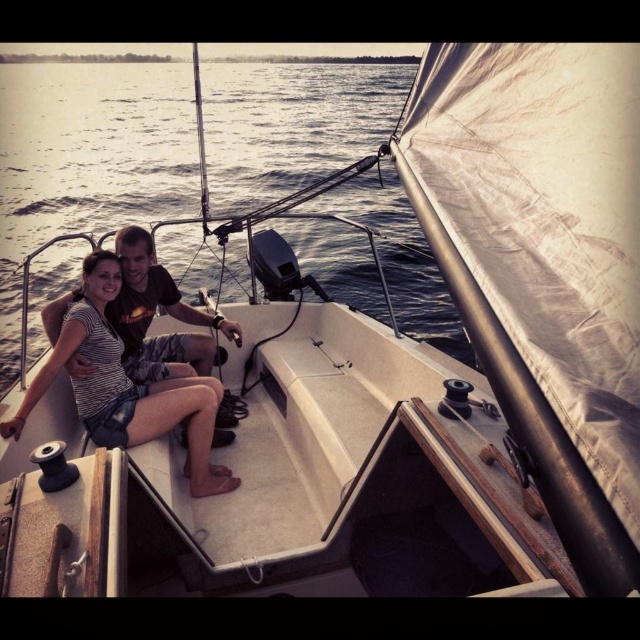
Between striped fabric dress at center and matte black shirt at center, which one appears on the left side from the viewer's perspective?

matte black shirt at center

Who is higher up, striped fabric dress at center or matte black shirt at center?

matte black shirt at center

Is point (196, 488) more distant than point (122, 291)?

No, it is not.

The image size is (640, 640). Find the location of `striped fabric dress at center`. striped fabric dress at center is located at coordinates (125, 387).

Does point (48, 272) come in front of point (140, 268)?

No, (48, 272) is further to viewer.

Which of these two, blue water at center or matte black shirt at center, stands taller?

blue water at center is taller.

The height and width of the screenshot is (640, 640). Find the location of `blue water at center`. blue water at center is located at coordinates (88, 161).

Is point (104, 122) farther from camera compared to point (12, 428)?

Yes, point (104, 122) is behind point (12, 428).

Can you confirm if blue water at center is positioned above striped fabric dress at center?

Indeed, blue water at center is positioned over striped fabric dress at center.

Does point (122, 141) lie in front of point (58, 348)?

That is False.

Where is `blue water at center`? This screenshot has width=640, height=640. blue water at center is located at coordinates coord(88,161).